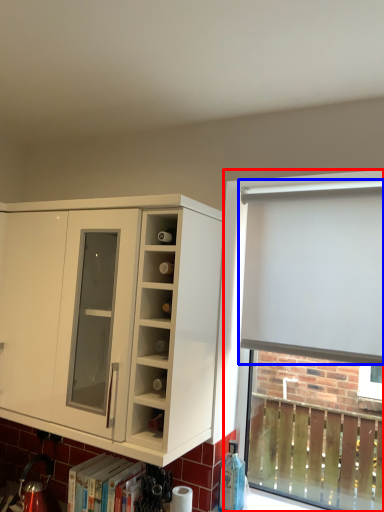
Question: Which point is further to the camera, bay window (highlighted by a red box) or curtain (highlighted by a blue box)?

Choices:
 (A) bay window
 (B) curtain

Answer: (A)